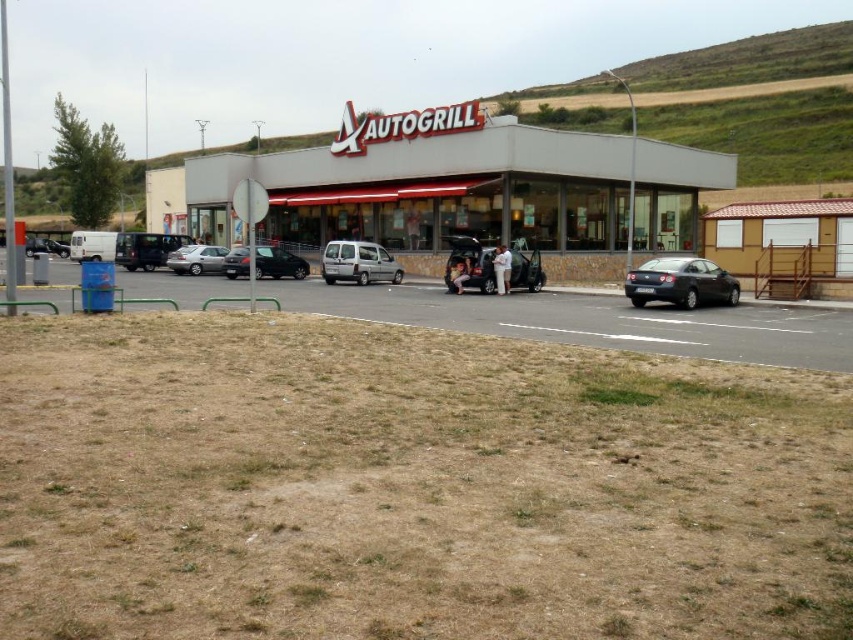
Is shiny black sedan at center-left above satin silver sedan at center?

Actually, shiny black sedan at center-left is below satin silver sedan at center.

Between shiny black sedan at center-left and satin silver sedan at center, which one appears on the left side from the viewer's perspective?

satin silver sedan at center is more to the left.

At what (x,y) coordinates should I click in order to perform the action: click on shiny black sedan at center-left. Please return your answer as a coordinate pair (x, y). Looking at the image, I should click on (277, 262).

Consider the image. Is metallic silver car at center wider than white cotton shirt at center?

No, metallic silver car at center is not wider than white cotton shirt at center.

Which of these two, metallic silver car at center or white cotton shirt at center, stands taller?

white cotton shirt at center

Describe the element at coordinates (469, 262) in the screenshot. The width and height of the screenshot is (853, 640). I see `metallic silver car at center` at that location.

Where is `metallic silver car at center`? metallic silver car at center is located at coordinates (469, 262).

Which of these two, shiny black sedan at center-left or white fabric person at center, stands taller?

shiny black sedan at center-left

Between point (245, 268) and point (451, 275), which one is positioned behind?

Positioned behind is point (245, 268).

What do you see at coordinates (277, 262) in the screenshot? Image resolution: width=853 pixels, height=640 pixels. I see `shiny black sedan at center-left` at bounding box center [277, 262].

Locate an element on the screen. This screenshot has width=853, height=640. shiny black sedan at center-left is located at coordinates (277, 262).